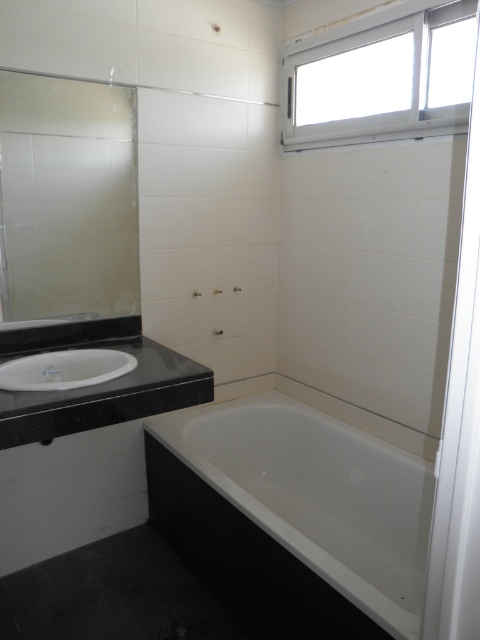
You are standing in the bathroom and want to determine which of the two points, point (x=96, y=115) or point (x=347, y=20), is closer to you. Based on the bathroom layout described, which point is nearer?

Point (x=96, y=115) is closer to the viewer than point (x=347, y=20).

You are designing a bathroom layout and need to know the relative sizes of the white glossy bathtub at lower center and the white plastic window at upper right. Which one has a larger surface area?

The white glossy bathtub at lower center is bigger than the white plastic window at upper right, so it has a larger surface area.